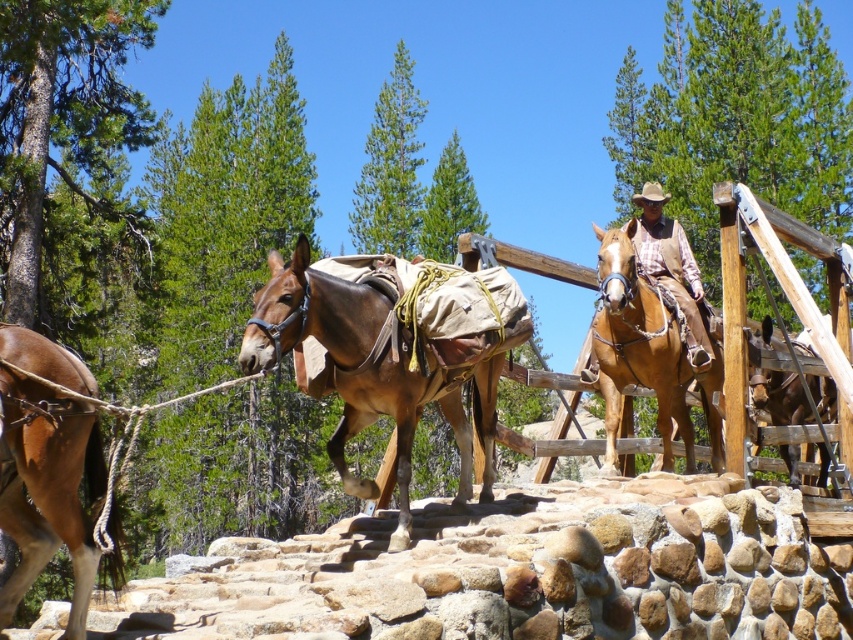
You are standing at the origin point in the image. Where is the brown leather horse at left located in terms of its 2D coordinates?

The brown leather horse at left is located at the 2D coordinates of point (47, 486).

You are a traveler trying to secure your gear on the brown leather saddle at right. You need to approach it from the front. Which direction should you move relative to the brown leather horse at center?

Since the brown leather horse at center is closer to the viewer than the brown leather saddle at right, you should move to the right of the brown leather horse at center to reach the brown leather saddle at right.